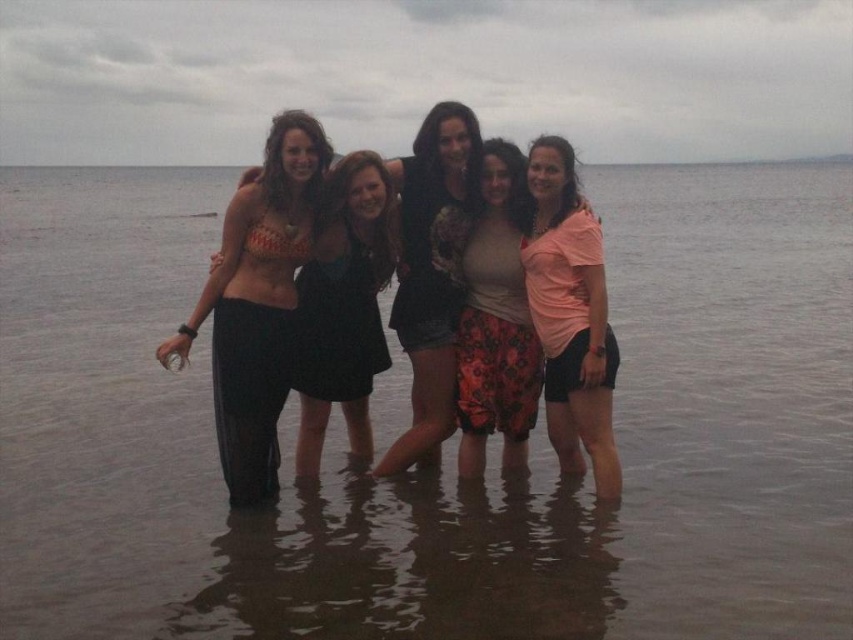
You are a photographer trying to capture a shot of the clear water at center and the matte black bikini top at left. Which object would you focus on if you want to highlight something larger in the frame?

The clear water at center is larger in size than the matte black bikini top at left, so you should focus on the clear water at center to highlight the larger object.

In the scene shown: You are a photographer trying to capture a group photo of the five individuals standing in the water. You want to ensure the matte bikini top at center is clearly visible in the photo. Based on its position, where should you focus your camera?

The matte bikini top at center is located at point [344,307], so you should focus your camera at that coordinate to ensure it is clearly visible.

You are a photographer at the beach scene. You need to adjust the lighting to highlight the pink cotton shirt at center and floral denim shorts at center. Since the shirt is above the shorts, where should you position the light source to ensure both items are well lit?

The pink cotton shirt at center is located above floral denim shorts at center. Position the light source in front of the person to evenly illuminate both the shirt and shorts.